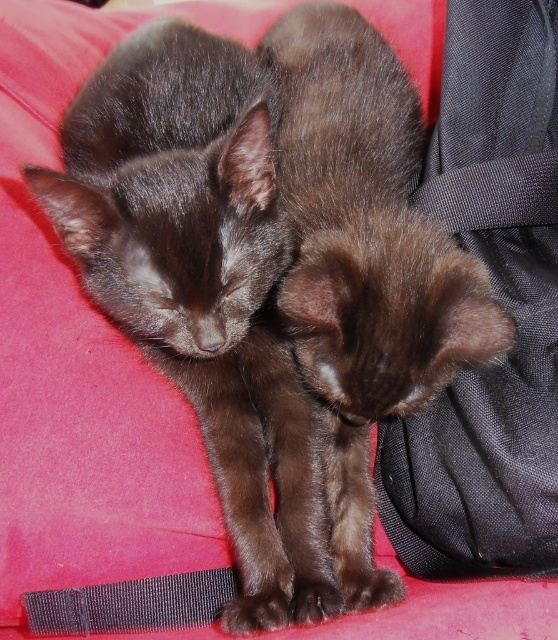
You are a photographer trying to capture the kittens on the pink surface. You notice a specific point marked at coordinates point (367, 227). Can you identify what this point corresponds to?

The point (367, 227) indicates the shiny brown kitten at center.

You are a photographer trying to capture a closeup of the shiny brown kitten at center and the black textured strap at lower left. Which object is located to the right of the other?

The shiny brown kitten at center is positioned on the right side of black textured strap at lower left.

You are trying to determine if the shiny brown kitten at center and the black textured strap at lower left can both fit into a small pet carrier that has a maximum width of 30 cm. Given their sizes, will they both fit comfortably?

The shiny brown kitten at center is larger in size than the black textured strap at lower left. However, without specific measurements for either object, it is impossible to determine if they will fit into the carrier. Please provide more details about their exact dimensions.